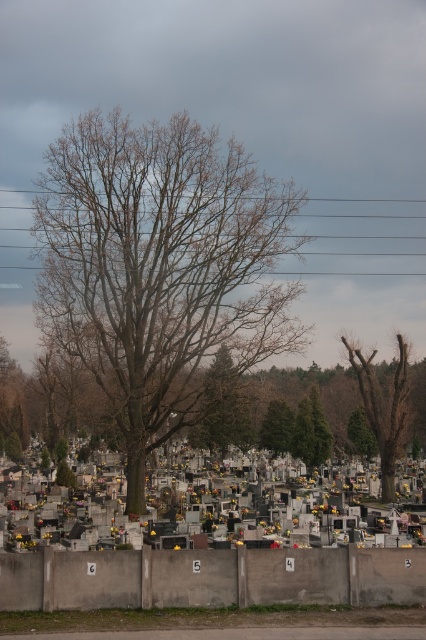
You are standing at the entrance of the cemetery and see a point marked at coordinates (x=383, y=406). What object does this point correspond to in the scene?

The point at coordinates (x=383, y=406) corresponds to the bare wood tree at right.